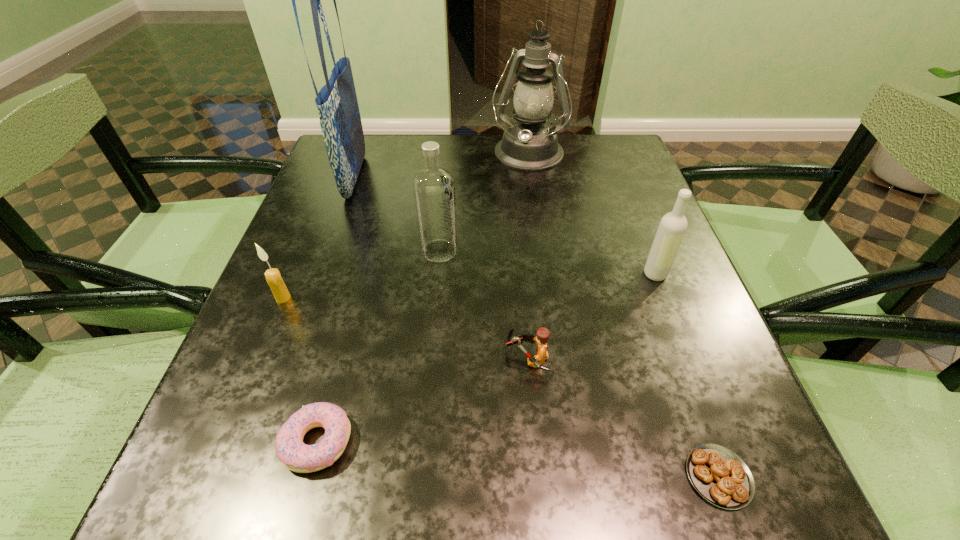
You are a GUI agent. You are given a task and a screenshot of the screen. Output one action in this format:
    pyautogui.click(x=<x>, y=<y>)
    Task: Click on the free spot located 0.280m holding a crossbow in the hands of the third shortest object
    
    Given the screenshot: What is the action you would take?
    pyautogui.click(x=334, y=358)

Locate an element on the screen. This screenshot has height=540, width=960. vacant space located 0.270m holding a crossbow in the hands of the third shortest object is located at coordinates (340, 358).

Identify the location of vacant space located on the right of the second shortest object. The image size is (960, 540). (486, 441).

Locate an element on the screen. vacant area located 0.350m on the left of the shortest object is located at coordinates (424, 476).

Where is `shopping bag present at the far edge`? This screenshot has height=540, width=960. shopping bag present at the far edge is located at coordinates pyautogui.click(x=340, y=121).

Where is `oil lamp situated at the far edge`? This screenshot has height=540, width=960. oil lamp situated at the far edge is located at coordinates (530, 144).

Where is `doughnut that is at the near edge`? doughnut that is at the near edge is located at coordinates click(x=296, y=456).

Image resolution: width=960 pixels, height=540 pixels. I want to click on pastry that is at the near edge, so click(x=720, y=476).

Locate an element on the screen. The height and width of the screenshot is (540, 960). shopping bag present at the left edge is located at coordinates (340, 121).

Find the location of a particular element. This screenshot has height=540, width=960. candle situated at the left edge is located at coordinates (273, 277).